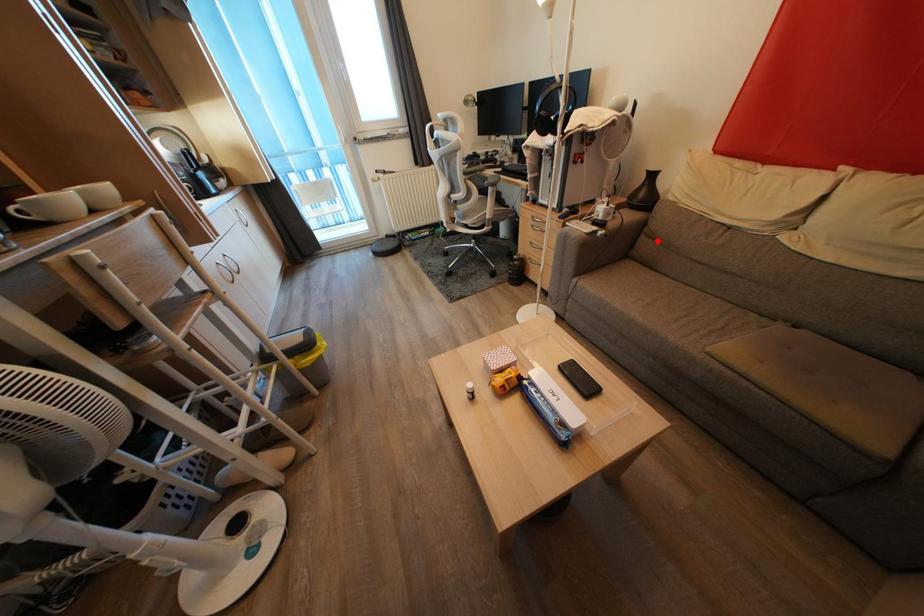
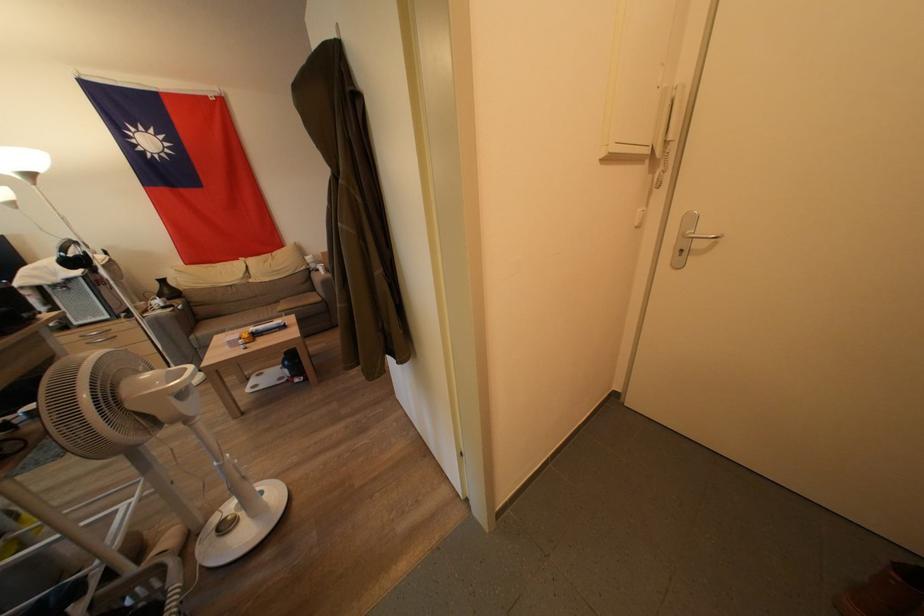
Question: I am providing you with two images of the same scene from different viewpoints. Given a red point in image1, look at the same physical point in image2. Is it:

Choices:
 (A) Closer to the viewpoint
 (B) Farther from the viewpoint

Answer: (A)